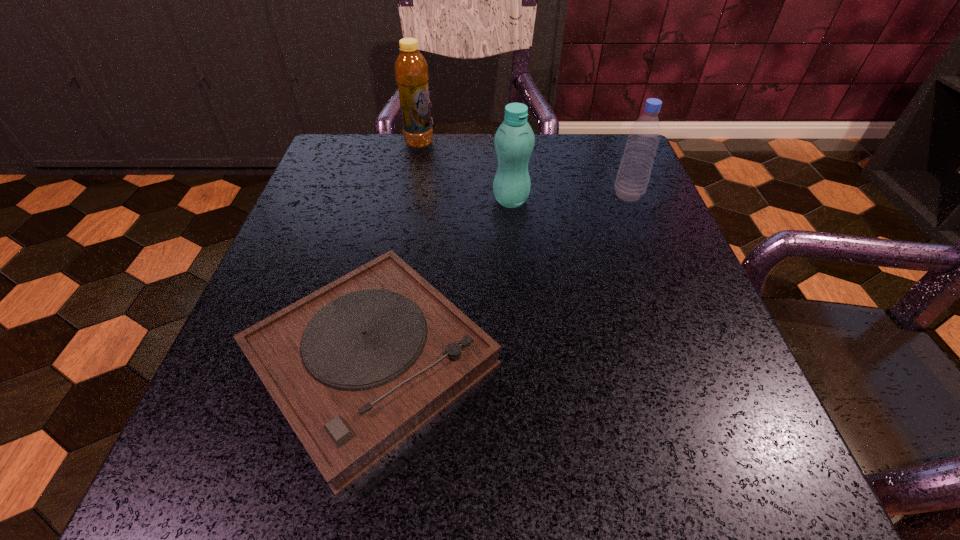
Locate an element on the screen. The image size is (960, 540). object at the near edge is located at coordinates (357, 367).

Image resolution: width=960 pixels, height=540 pixels. I want to click on object that is at the left edge, so click(x=357, y=367).

Find the location of a particular element. The width and height of the screenshot is (960, 540). object present at the right edge is located at coordinates [633, 175].

I want to click on object that is at the near left corner, so click(357, 367).

At what (x,y) coordinates should I click in order to perform the action: click on object at the far right corner. Please return your answer as a coordinate pair (x, y). Looking at the image, I should click on [x=633, y=175].

In the image, there is a desktop. Find the location of `vacant space at the far edge`. vacant space at the far edge is located at coordinates (429, 167).

I want to click on vacant space at the near edge of the desktop, so click(x=627, y=483).

The image size is (960, 540). I want to click on vacant space at the left edge, so click(x=217, y=416).

Locate an element on the screen. The width and height of the screenshot is (960, 540). vacant space at the right edge of the desktop is located at coordinates (649, 361).

You are a GUI agent. You are given a task and a screenshot of the screen. Output one action in this format:
    pyautogui.click(x=<x>, y=<y>)
    Task: Click on the vacant space at the far left corner of the desktop
    The image size is (960, 540).
    Given the screenshot: What is the action you would take?
    pyautogui.click(x=351, y=167)